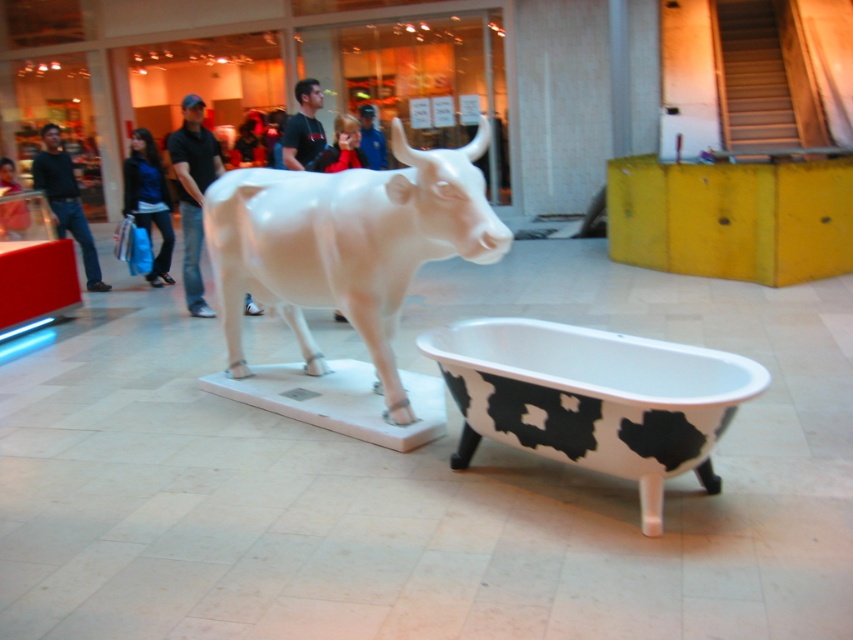
Who is positioned more to the right, white glossy bull at center or smooth blue jacket at center?

Positioned to the right is white glossy bull at center.

Who is more forward, [482,248] or [351,147]?

Point [482,248] is in front.

The height and width of the screenshot is (640, 853). I want to click on white glossy bull at center, so click(x=346, y=246).

Between cow print porcelain bathtub at center and matte black jacket at left, which one is positioned lower?

cow print porcelain bathtub at center is lower down.

This screenshot has height=640, width=853. In order to click on cow print porcelain bathtub at center in this screenshot , I will do coord(593,397).

Between white glossy bull at center and black jeans at left, which one appears on the right side from the viewer's perspective?

white glossy bull at center is more to the right.

Who is lower down, white glossy bull at center or black jeans at left?

white glossy bull at center

Identify the location of white glossy bull at center. This screenshot has width=853, height=640. 346,246.

This screenshot has width=853, height=640. Identify the location of white glossy bull at center. (346, 246).